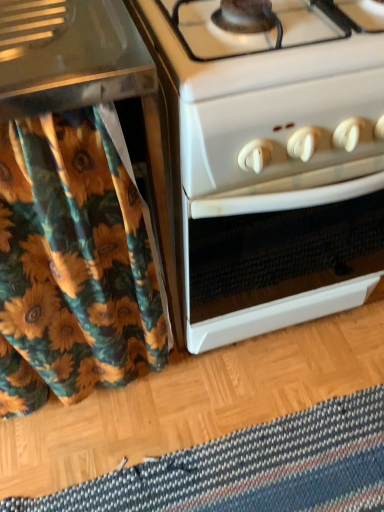
Locate an element on the screen. The image size is (384, 512). vacant area on top of striped woolen mat at lower center (from a real-world perspective) is located at coordinates (261, 473).